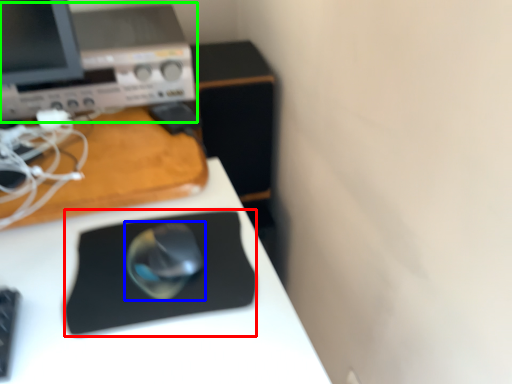
Question: Estimate the real-world distances between objects in this image. Which object is closer to mousepad (highlighted by a red box), mouse (highlighted by a blue box) or desktop computer (highlighted by a green box)?

Choices:
 (A) mouse
 (B) desktop computer

Answer: (A)